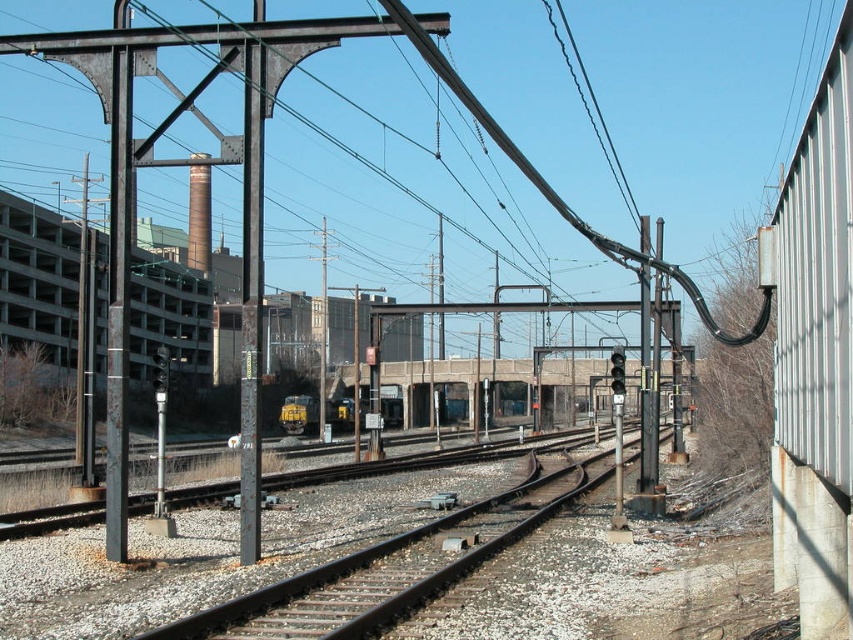
Is point (422, 586) behind point (590, 100)?

That is False.

Does smooth steel tracks at center have a greater width compared to black wire at upper center?

In fact, smooth steel tracks at center might be narrower than black wire at upper center.

Between point (338, 570) and point (589, 83), which one is positioned in front?

Point (338, 570) is in front.

Locate an element on the screen. smooth steel tracks at center is located at coordinates (381, 572).

Is the position of rusty metal pole at left less distant than that of black wire at upper center?

That is True.

Between point (123, 476) and point (567, 38), which one is positioned behind?

The point (567, 38) is more distant.

Is point (128, 152) positioned behind point (560, 51)?

No, (128, 152) is in front of (560, 51).

At what (x,y) coordinates should I click in order to perform the action: click on rusty metal pole at left. Please return your answer as a coordinate pair (x, y). This screenshot has width=853, height=640. Looking at the image, I should click on (119, 304).

Does rusty metal pole at center have a greater height compared to yellow matte train at center?

Yes, rusty metal pole at center is taller than yellow matte train at center.

Where is `rusty metal pole at center`? rusty metal pole at center is located at coordinates (251, 301).